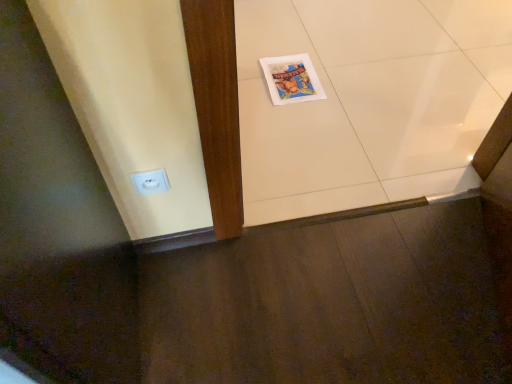
What is the approximate height of white glossy tile at center?

The height of white glossy tile at center is 2.87 inches.

Image resolution: width=512 pixels, height=384 pixels. What do you see at coordinates (150, 181) in the screenshot? I see `white plastic electric outlet at lower left` at bounding box center [150, 181].

Locate an element on the screen. This screenshot has width=512, height=384. matte paper comic book at center is located at coordinates (291, 79).

Is matte paper comic book at center not close to white plastic electric outlet at lower left?

No, there isn't a large distance between matte paper comic book at center and white plastic electric outlet at lower left.

From the picture: Measure the distance between matte paper comic book at center and white plastic electric outlet at lower left.

They are 33.40 inches apart.

Is point (265, 62) more distant than point (153, 182)?

Yes, it is behind point (153, 182).

Considering the relative sizes of matte paper comic book at center and white plastic electric outlet at lower left in the image provided, is matte paper comic book at center smaller than white plastic electric outlet at lower left?

Actually, matte paper comic book at center might be larger than white plastic electric outlet at lower left.

Considering the relative sizes of matte paper comic book at center and white glossy tile at center in the image provided, is matte paper comic book at center bigger than white glossy tile at center?

Incorrect, matte paper comic book at center is not larger than white glossy tile at center.

From a real-world perspective, which is physically below, matte paper comic book at center or white glossy tile at center?

white glossy tile at center, from a real-world perspective.

Considering the sizes of objects matte paper comic book at center and white glossy tile at center in the image provided, who is shorter, matte paper comic book at center or white glossy tile at center?

With less height is matte paper comic book at center.

Between point (268, 86) and point (402, 195), which one is positioned behind?

The point (268, 86) is farther from the camera.

Considering the relative positions of white plastic electric outlet at lower left and matte paper comic book at center in the image provided, is white plastic electric outlet at lower left in front of matte paper comic book at center?

That is True.

Which is further, (133, 177) or (324, 98)?

The point (324, 98) is behind.

Can you confirm if white plastic electric outlet at lower left is shorter than matte paper comic book at center?

Incorrect, the height of white plastic electric outlet at lower left does not fall short of that of matte paper comic book at center.

From a real-world perspective, which object stands above the other?

white plastic electric outlet at lower left is physically above.

From a real-world perspective, is white plastic electric outlet at lower left located beneath white glossy tile at center?

Actually, white plastic electric outlet at lower left is physically above white glossy tile at center in the real world.

Is there a large distance between white plastic electric outlet at lower left and white glossy tile at center?

Yes.

Is white plastic electric outlet at lower left in front of white glossy tile at center?

That is False.

From a real-world perspective, which is physically above, white glossy tile at center or matte paper comic book at center?

In real-world perspective, matte paper comic book at center is above.

Is the position of white glossy tile at center more distant than that of matte paper comic book at center?

No, it is in front of matte paper comic book at center.

Choose the correct answer: Is white glossy tile at center inside matte paper comic book at center or outside it?

The correct answer is: outside.

Is white glossy tile at center next to matte paper comic book at center and touching it?

white glossy tile at center and matte paper comic book at center are clearly separated.

Can you confirm if white glossy tile at center is positioned to the left of white plastic electric outlet at lower left?

Incorrect, white glossy tile at center is not on the left side of white plastic electric outlet at lower left.

Is white glossy tile at center inside or outside of white plastic electric outlet at lower left?

white glossy tile at center is not inside white plastic electric outlet at lower left, it's outside.

From a real-world perspective, which object rests below the other?

white glossy tile at center, from a real-world perspective.

Where is `comic book on the right of white plastic electric outlet at lower left`? This screenshot has width=512, height=384. comic book on the right of white plastic electric outlet at lower left is located at coordinates (291, 79).

Image resolution: width=512 pixels, height=384 pixels. What are the coordinates of `ceramic tile below the matte paper comic book at center (from a real-world perspective)` in the screenshot? It's located at (368, 101).

Looking at this image, estimate the real-world distances between objects in this image. Which object is closer to white plastic electric outlet at lower left, matte paper comic book at center or white glossy tile at center?

Among the two, matte paper comic book at center is located nearer to white plastic electric outlet at lower left.

When comparing their distances from white glossy tile at center, does matte paper comic book at center or white plastic electric outlet at lower left seem further?

white plastic electric outlet at lower left is positioned further to the anchor white glossy tile at center.

Based on their spatial positions, is white plastic electric outlet at lower left or white glossy tile at center closer to matte paper comic book at center?

The object closer to matte paper comic book at center is white glossy tile at center.

Estimate the real-world distances between objects in this image. Which object is further from matte paper comic book at center, white glossy tile at center or white plastic electric outlet at lower left?

white plastic electric outlet at lower left is further to matte paper comic book at center.

Which object lies nearer to the anchor point white glossy tile at center, white plastic electric outlet at lower left or matte paper comic book at center?

matte paper comic book at center is closer to white glossy tile at center.

When comparing their distances from white plastic electric outlet at lower left, does white glossy tile at center or matte paper comic book at center seem further?

white glossy tile at center is positioned further to the anchor white plastic electric outlet at lower left.

Where is `comic book situated between white plastic electric outlet at lower left and white glossy tile at center from left to right`? The image size is (512, 384). comic book situated between white plastic electric outlet at lower left and white glossy tile at center from left to right is located at coordinates (291, 79).